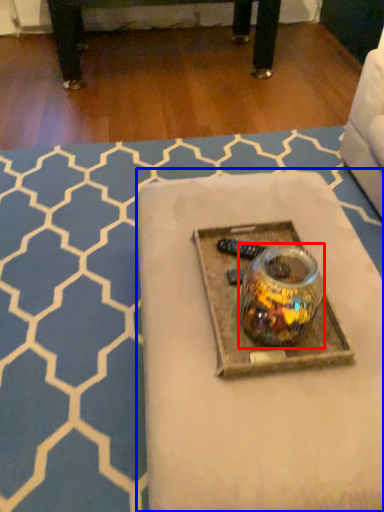
Question: Which of the following is the closest to the observer, glass jar (highlighted by a red box) or table (highlighted by a blue box)?

Choices:
 (A) glass jar
 (B) table

Answer: (A)